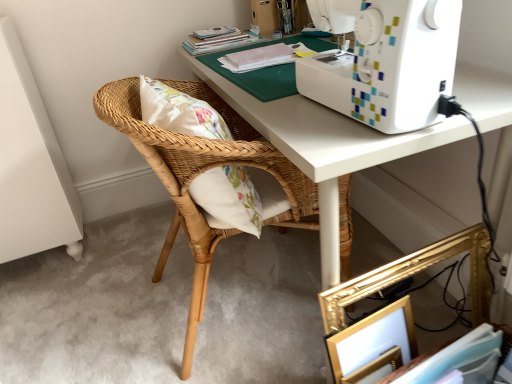
What are the coordinates of `unoccupied space behind matte white book at upper center, the second book in the right-to-left sequence` in the screenshot? It's located at (273, 41).